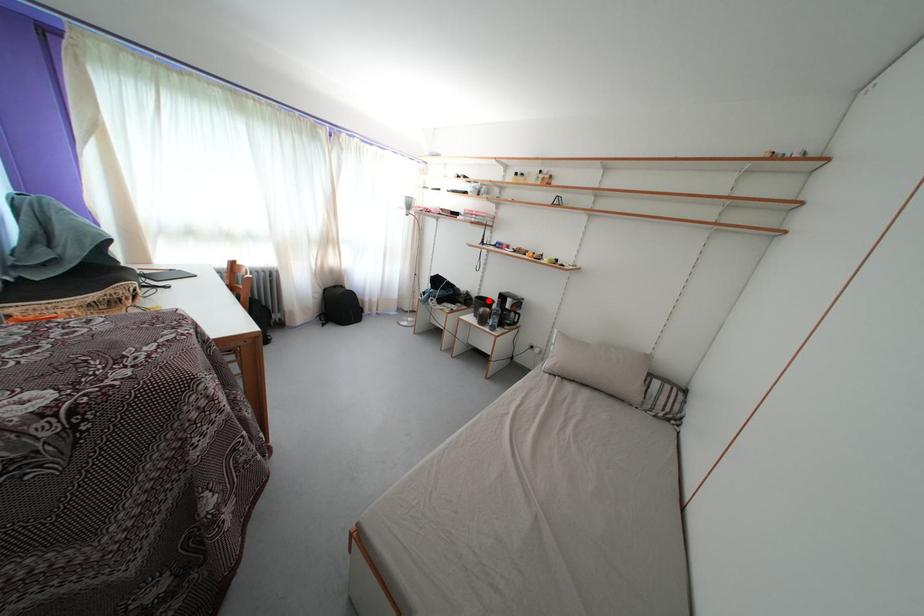
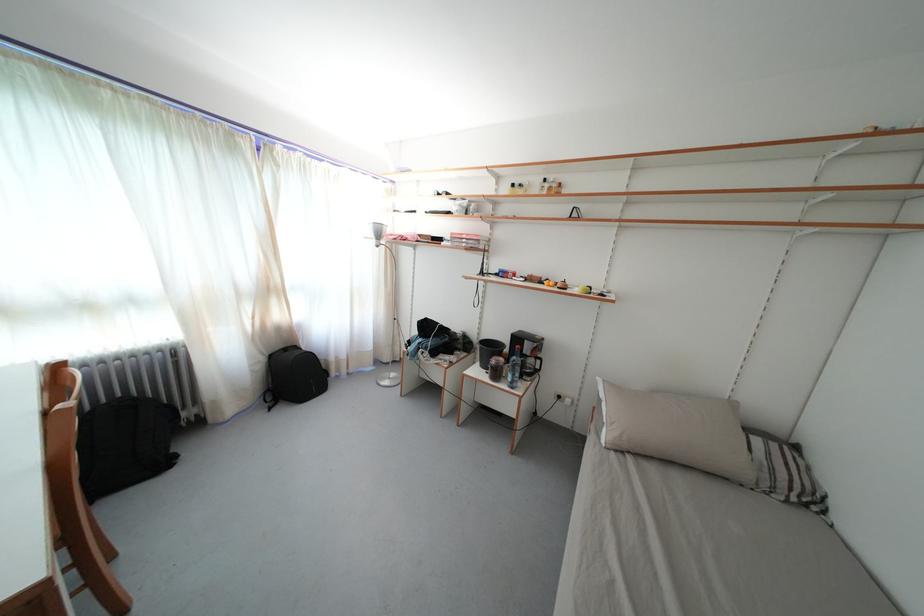
In the second image, find the point that corresponds to the highlighted location in the first image.

(491, 341)